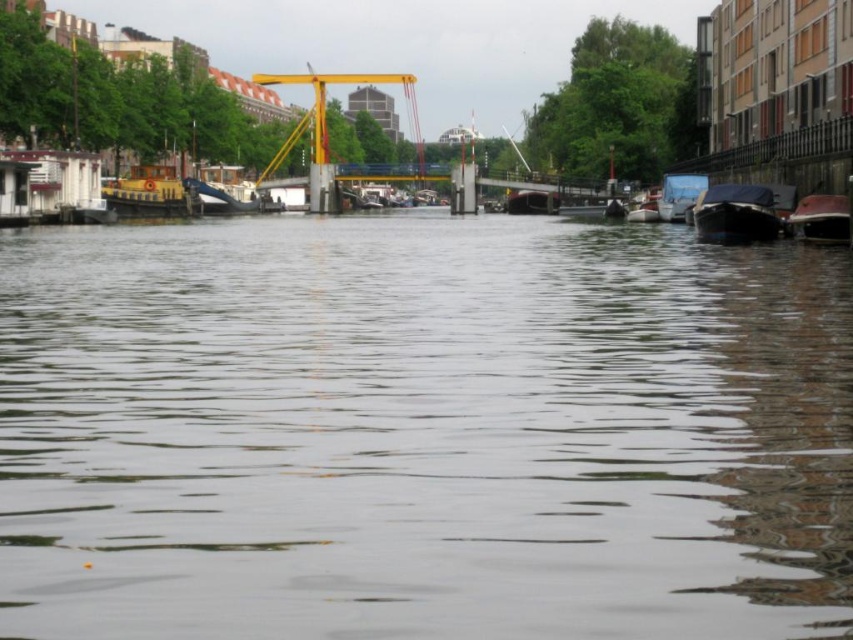
Question: Does transparent water at center appear on the left side of dark blue tarp at right?

Choices:
 (A) no
 (B) yes

Answer: (B)

Question: Among these points, which one is nearest to the camera?

Choices:
 (A) (764, 208)
 (B) (692, 186)

Answer: (A)

Question: Does transparent water at center have a larger size compared to shiny red boat at right?

Choices:
 (A) yes
 (B) no

Answer: (A)

Question: Among these objects, which one is nearest to the camera?

Choices:
 (A) shiny red boat at right
 (B) metallic silver boat at center

Answer: (A)

Question: Is dark blue tarp at right to the left of blue tarpaulin boat at right from the viewer's perspective?

Choices:
 (A) no
 (B) yes

Answer: (B)

Question: Which point appears farthest from the camera in this image?

Choices:
 (A) (677, 186)
 (B) (648, 220)

Answer: (B)